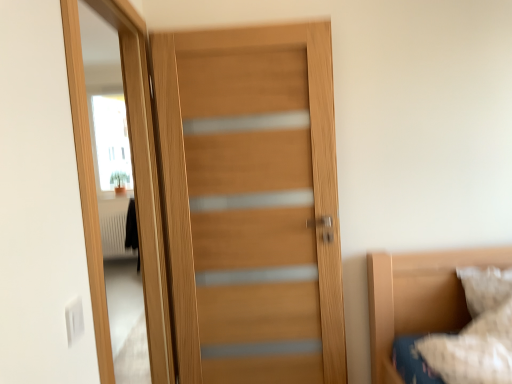
Question: From the image's perspective, relative to wooden door at left, is white textured pillow at lower right above or below?

Choices:
 (A) above
 (B) below

Answer: (B)

Question: In terms of size, does white textured pillow at lower right appear bigger or smaller than wooden door at left?

Choices:
 (A) big
 (B) small

Answer: (B)

Question: Which object is the closest to the white textured pillow at lower right?

Choices:
 (A) wooden door at center
 (B) wooden door at left

Answer: (A)

Question: Considering the real-world distances, which object is farthest from the wooden door at left?

Choices:
 (A) wooden door at center
 (B) white textured pillow at lower right

Answer: (B)